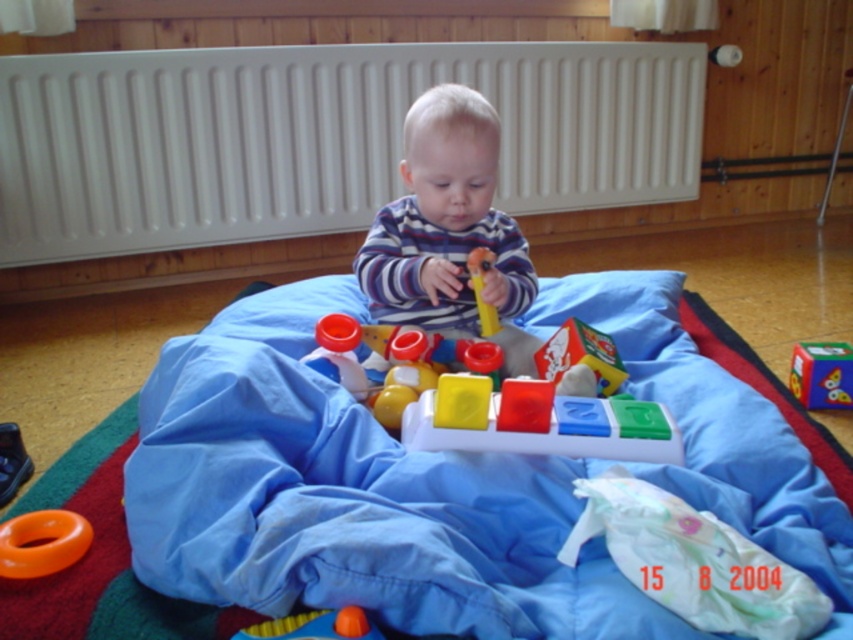
Question: Which of the following is the farthest from the observer?

Choices:
 (A) (302, 65)
 (B) (413, 241)
 (C) (828, 348)
 (D) (653, 602)

Answer: (A)

Question: Which of the following is the farthest from the observer?

Choices:
 (A) striped fabric boy at center
 (B) blue fabric blanket at center
 (C) white plastic radiator at upper center

Answer: (C)

Question: Can you confirm if blue fabric blanket at center is positioned below rubber orange ball at lower left?

Choices:
 (A) yes
 (B) no

Answer: (B)

Question: Which of the following is the farthest from the observer?

Choices:
 (A) (78, 536)
 (B) (415, 214)
 (C) (822, 406)

Answer: (C)

Question: Does orange rubber ring at lower left appear under multicolored plastic cube at center?

Choices:
 (A) no
 (B) yes

Answer: (B)

Question: Is striped fabric boy at center closer to camera compared to rubber orange ball at lower left?

Choices:
 (A) yes
 (B) no

Answer: (B)